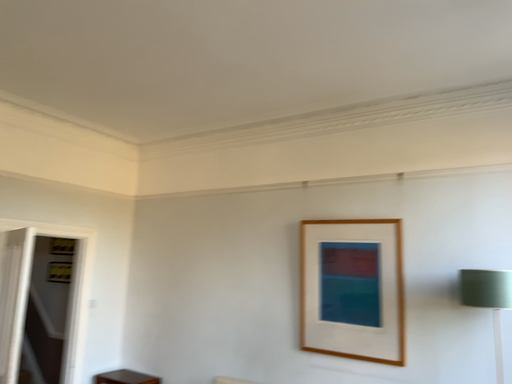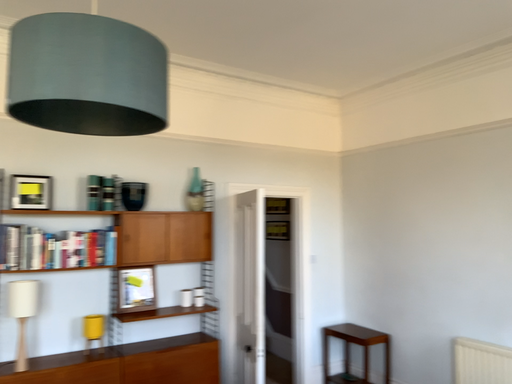
Question: Which way did the camera rotate in the video?

Choices:
 (A) rotated downward
 (B) rotated upward

Answer: (A)